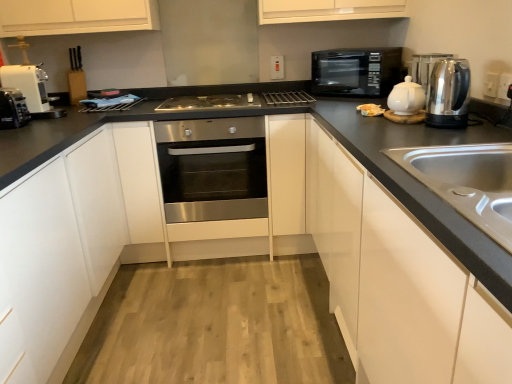
Question: From a real-world perspective, is white plastic coffee machine at left positioned above or below satin silver kettle at upper right?

Choices:
 (A) below
 (B) above

Answer: (A)

Question: Would you say white plastic coffee machine at left is to the left or to the right of satin silver kettle at upper right in the picture?

Choices:
 (A) right
 (B) left

Answer: (B)

Question: Which object is positioned closest to the polished stainless steel kettle at right?

Choices:
 (A) white plastic electric outlet at upper center, acting as the 1th electric outlet starting from the left
 (B) white glossy cabinet at right, which is counted as the first cabinetry, starting from the right
 (C) white matte cabinet at lower left, the first cabinetry in the left-to-right sequence
 (D) stainless steel oven at center
 (E) white plastic coffee machine at left

Answer: (B)

Question: Estimate the real-world distances between objects in this image. Which object is farther from the white plastic coffee machine at left?

Choices:
 (A) stainless steel sink at right
 (B) stainless steel gas stove at center
 (C) white plastic toaster at left
 (D) white glossy tea pot at upper right
 (E) polished stainless steel kettle at right

Answer: (A)